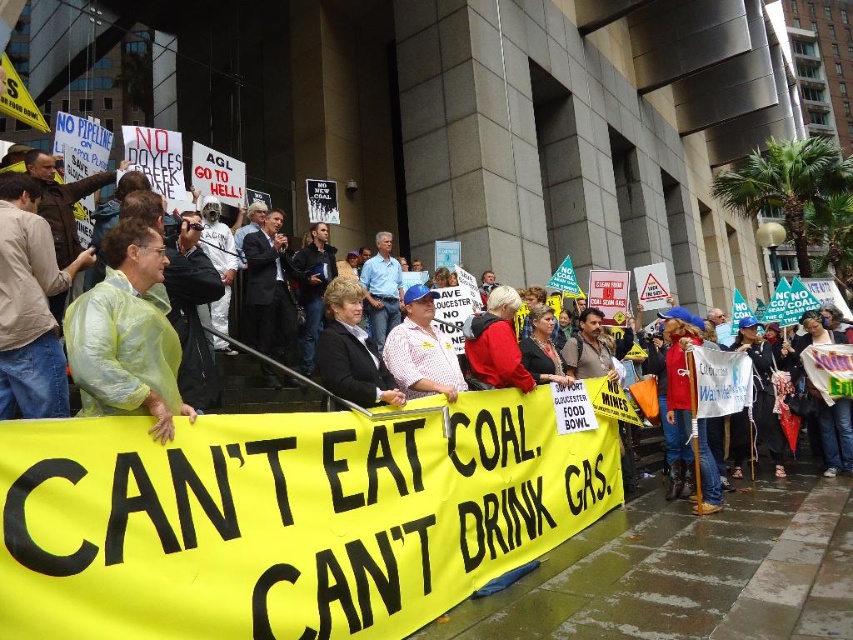
Question: Which of these objects is positioned farthest from the red matte jacket at center?

Choices:
 (A) plaid shirt at center
 (B) light blue shirt at center
 (C) green plastic bag at left
 (D) light green plastic bag at left

Answer: (B)

Question: Considering the relative positions of dark suit at center and light blue shirt at center in the image provided, where is dark suit at center located with respect to light blue shirt at center?

Choices:
 (A) left
 (B) right

Answer: (A)

Question: Which object is closer to the camera taking this photo?

Choices:
 (A) plaid shirt at center
 (B) red matte jacket at center

Answer: (A)

Question: Is light green plastic bag at left positioned behind dark suit at center?

Choices:
 (A) yes
 (B) no

Answer: (B)

Question: Does black fabric jacket at center lie behind light blue shirt at center?

Choices:
 (A) no
 (B) yes

Answer: (A)

Question: Which point appears farthest from the camera in this image?

Choices:
 (A) (335, 378)
 (B) (293, 324)

Answer: (B)